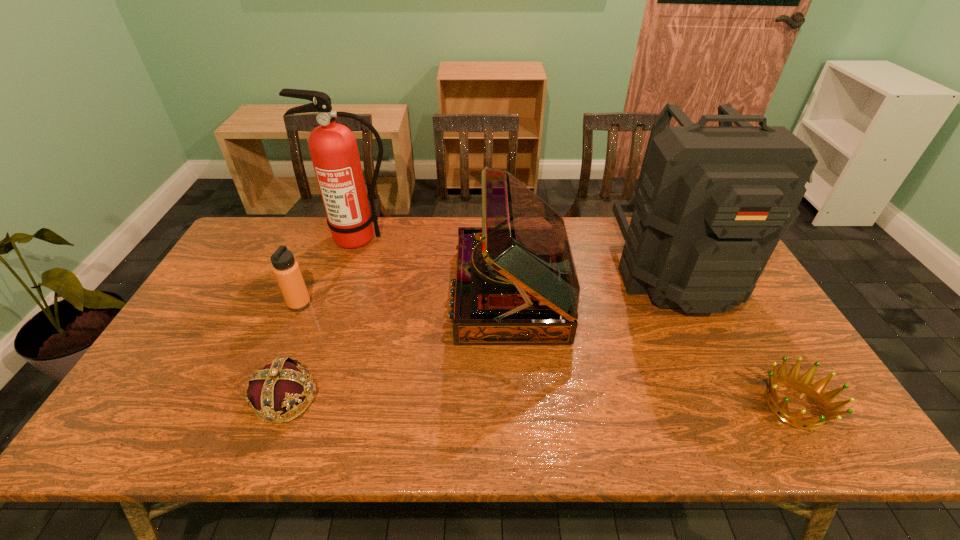
The height and width of the screenshot is (540, 960). Find the location of `vacant position in the image that satisfies the following two spatial constraints: 1. on the front-facing side of the record player; 2. on the left side of the shorter crown`. vacant position in the image that satisfies the following two spatial constraints: 1. on the front-facing side of the record player; 2. on the left side of the shorter crown is located at coordinates (518, 406).